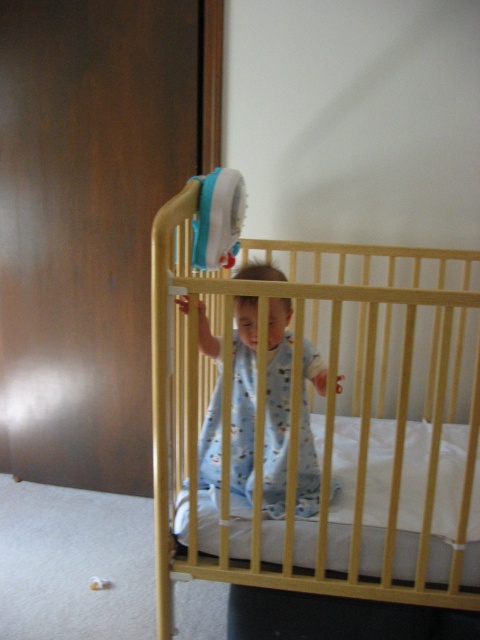
Question: Which object is farther from the camera taking this photo?

Choices:
 (A) blue fabric toy at upper center
 (B) yellow wood crib at center

Answer: (A)

Question: Does yellow wood crib at center appear on the right side of blue fabric toy at upper center?

Choices:
 (A) yes
 (B) no

Answer: (A)

Question: Which point appears closest to the camera in this image?

Choices:
 (A) (371, 499)
 (B) (194, 227)

Answer: (B)

Question: Is light blue cotton onesie at center positioned in front of blue fabric toy at upper center?

Choices:
 (A) no
 (B) yes

Answer: (B)

Question: Does yellow wood crib at center have a smaller size compared to light blue cotton onesie at center?

Choices:
 (A) no
 (B) yes

Answer: (A)

Question: Which of the following is the farthest from the observer?

Choices:
 (A) blue fabric toy at upper center
 (B) light blue cotton onesie at center

Answer: (A)